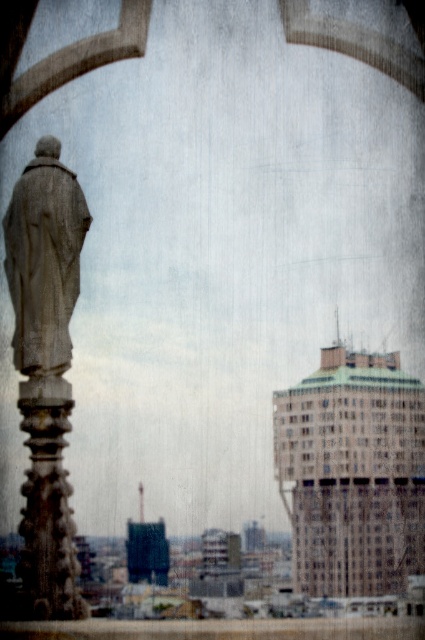
Based on the photo, you are an architect visiting a historical site. You notice a gray stone statue at left and a carved stone pillar at left in the scene. Which object is positioned closer to the left side of the archway?

The gray stone statue at left is positioned closer to the left side of the archway than the carved stone pillar at left.

You are standing in front of the arched opening and want to take a photo of the gray stone statue at left. Where should you position yourself to ensure the statue is centered in your camera frame?

To center the gray stone statue at left in your camera frame, position yourself directly in front of the statue at point coordinates approximately 0.406 on the horizontal axis and 0.104 on the vertical axis.

You are standing in a cathedral and see the stone statue at left. If you want to take a photo of the statue while also including the cityscape behind the arched opening, where should you position yourself relative to the statue?

You should position yourself to the right of the stone statue at left to include both the statue and the cityscape behind the arched opening in your photo.